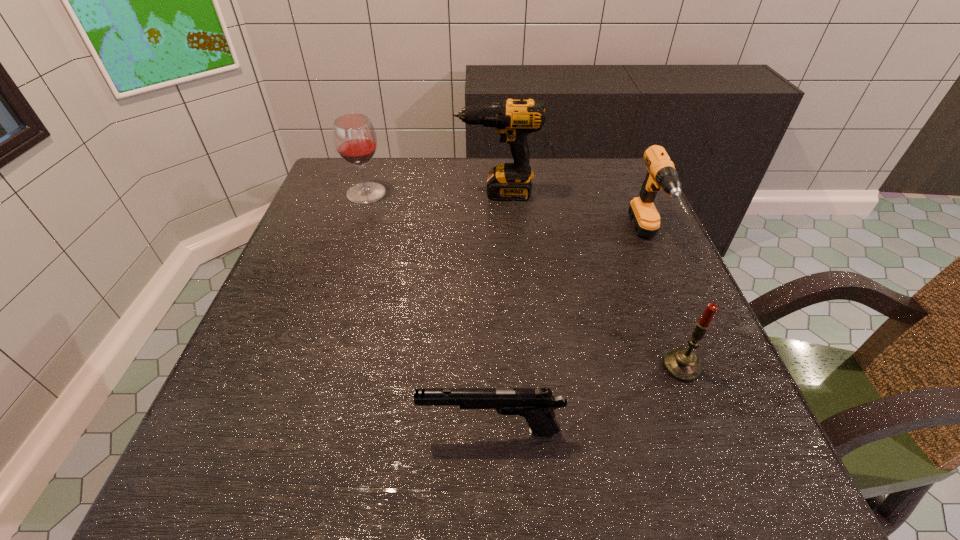
At what (x,y) coordinates should I click in order to perform the action: click on object that is at the left edge. Please return your answer as a coordinate pair (x, y). Looking at the image, I should click on (x=355, y=140).

The height and width of the screenshot is (540, 960). I want to click on drill located at the right edge, so click(661, 174).

The height and width of the screenshot is (540, 960). Identify the location of candle at the right edge. (682, 364).

Find the location of `object that is positioned at the far left corner`. object that is positioned at the far left corner is located at coordinates (355, 140).

Locate an element on the screen. vacant space at the far edge of the desktop is located at coordinates (578, 192).

Where is `free spot at the near edge of the desktop`? This screenshot has height=540, width=960. free spot at the near edge of the desktop is located at coordinates coord(476,502).

Image resolution: width=960 pixels, height=540 pixels. I want to click on vacant space at the left edge of the desktop, so click(x=269, y=423).

Identify the location of vacant area at the right edge. (708, 434).

Identify the location of vacant space at the near left corner of the desktop. (280, 447).

I want to click on vacant space at the far right corner of the desktop, so click(578, 169).